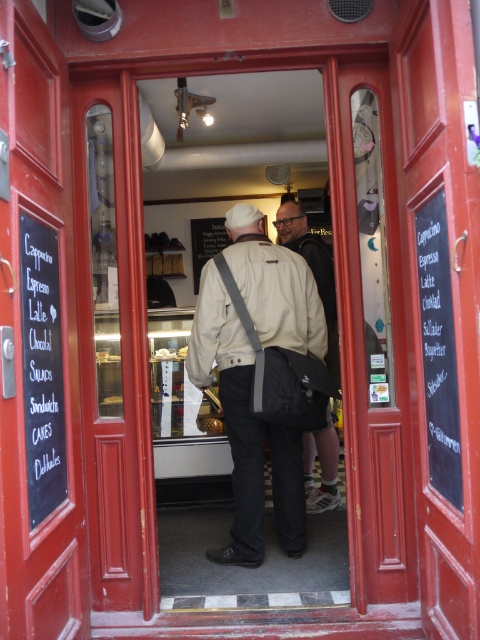
Question: Which object appears closest to the camera in this image?

Choices:
 (A) black chalkboard at left
 (B) black chalkboard at center
 (C) matte beige jacket at center
 (D) smooth glass door at center

Answer: (B)

Question: Which of the following is the closest to the observer?

Choices:
 (A) (27, 481)
 (B) (109, 140)
 (C) (252, 452)

Answer: (A)

Question: Does black chalkboard at center appear on the right side of black chalkboard at right?

Choices:
 (A) no
 (B) yes

Answer: (A)

Question: Is black chalkboard at center to the right of matte beige jacket at center from the viewer's perspective?

Choices:
 (A) no
 (B) yes

Answer: (A)

Question: Which point appears closest to the camera in this image?

Choices:
 (A) (23, 294)
 (B) (330, 484)
 (C) (70, 314)
 (D) (240, 454)

Answer: (A)

Question: Can you confirm if smooth wood door at center is positioned to the left of smooth wooden door at center?

Choices:
 (A) yes
 (B) no

Answer: (B)